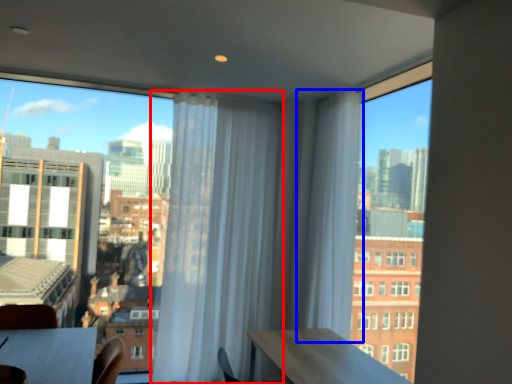
Question: Which object is closer to the camera taking this photo, curtain (highlighted by a red box) or curtain (highlighted by a blue box)?

Choices:
 (A) curtain
 (B) curtain

Answer: (B)